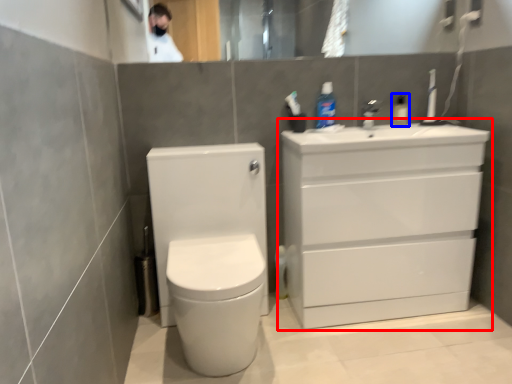
Question: Which object appears farthest to the camera in this image, bathroom cabinet (highlighted by a red box) or toiletry (highlighted by a blue box)?

Choices:
 (A) bathroom cabinet
 (B) toiletry

Answer: (B)